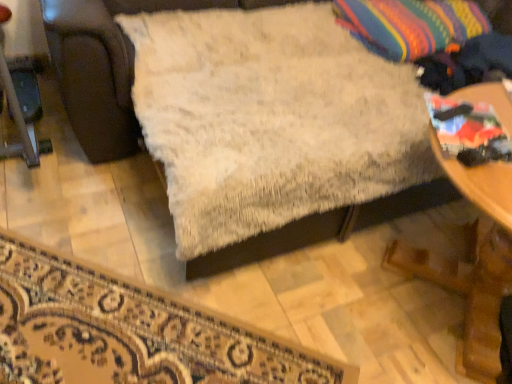
Question: Is white fluffy rug at lower center looking in the opposite direction of white fluffy blanket at center?

Choices:
 (A) yes
 (B) no

Answer: (B)

Question: Is white fluffy rug at lower center far away from white fluffy blanket at center?

Choices:
 (A) yes
 (B) no

Answer: (B)

Question: Is white fluffy rug at lower center located outside white fluffy blanket at center?

Choices:
 (A) no
 (B) yes

Answer: (B)

Question: Is white fluffy blanket at center located within white fluffy rug at lower center?

Choices:
 (A) yes
 (B) no

Answer: (B)

Question: Is white fluffy rug at lower center facing towards white fluffy blanket at center?

Choices:
 (A) yes
 (B) no

Answer: (B)

Question: Can you confirm if white fluffy rug at lower center is shorter than white fluffy blanket at center?

Choices:
 (A) yes
 (B) no

Answer: (A)

Question: Is white fluffy blanket at center looking in the opposite direction of wooden table at lower right?

Choices:
 (A) no
 (B) yes

Answer: (A)

Question: Considering the relative sizes of white fluffy blanket at center and wooden table at lower right in the image provided, is white fluffy blanket at center shorter than wooden table at lower right?

Choices:
 (A) no
 (B) yes

Answer: (A)

Question: Considering the relative sizes of white fluffy blanket at center and wooden table at lower right in the image provided, is white fluffy blanket at center smaller than wooden table at lower right?

Choices:
 (A) no
 (B) yes

Answer: (A)

Question: Considering the relative sizes of white fluffy blanket at center and wooden table at lower right in the image provided, is white fluffy blanket at center wider than wooden table at lower right?

Choices:
 (A) no
 (B) yes

Answer: (B)

Question: Considering the relative positions of white fluffy blanket at center and wooden table at lower right in the image provided, is white fluffy blanket at center to the left of wooden table at lower right from the viewer's perspective?

Choices:
 (A) no
 (B) yes

Answer: (B)

Question: Does white fluffy blanket at center turn towards wooden table at lower right?

Choices:
 (A) no
 (B) yes

Answer: (B)

Question: Considering the relative sizes of multicolored woven throw pillow at upper right and white fluffy blanket at center in the image provided, is multicolored woven throw pillow at upper right bigger than white fluffy blanket at center?

Choices:
 (A) no
 (B) yes

Answer: (A)